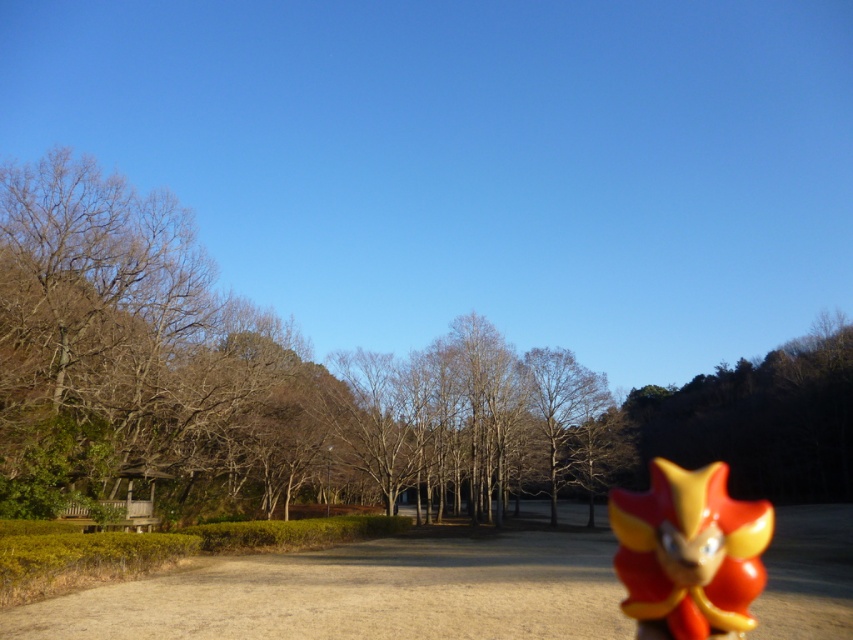
Question: Which of the following is the closest to the observer?

Choices:
 (A) (260, 600)
 (B) (51, 554)
 (C) (503, 476)

Answer: (A)

Question: Does shiny orange plastic toy at lower right have a greater width compared to brown/dry bark tree at center?

Choices:
 (A) yes
 (B) no

Answer: (A)

Question: In this image, where is smooth gravel path at center located relative to shiny orange plastic toy at lower right?

Choices:
 (A) left
 (B) right

Answer: (A)

Question: Which of the following is the closest to the observer?

Choices:
 (A) tap(659, 611)
 (B) tap(277, 605)

Answer: (A)

Question: Which point is closer to the camera?

Choices:
 (A) click(772, 518)
 (B) click(548, 595)

Answer: (A)

Question: Can you confirm if shiny orange plastic toy at lower right is positioned to the left of green leafy hedge at lower left?

Choices:
 (A) no
 (B) yes

Answer: (A)